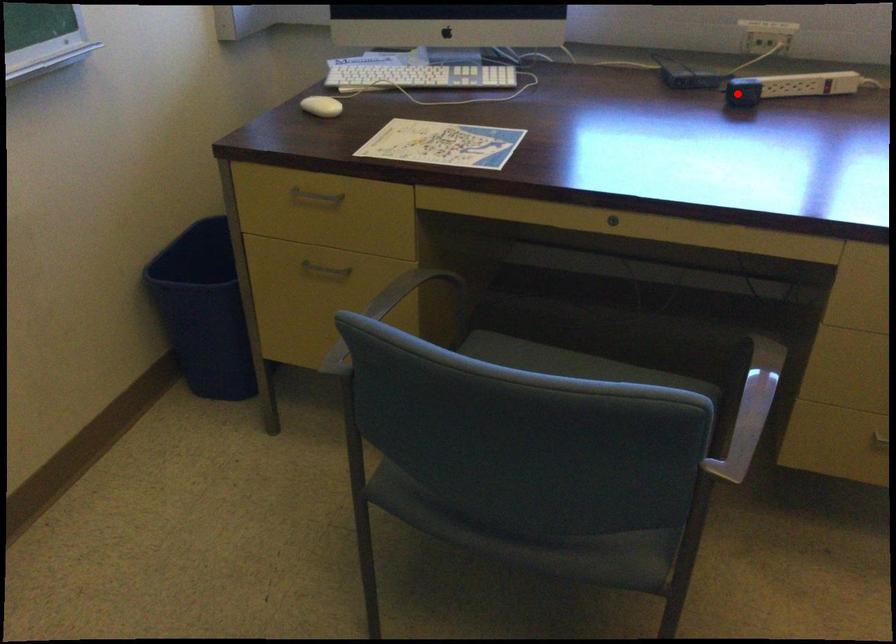
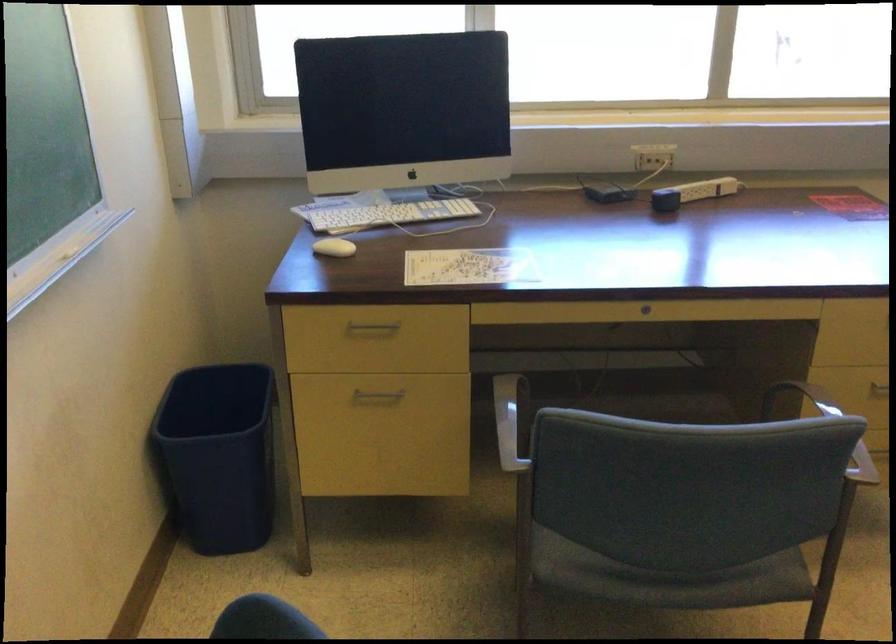
Question: I am providing you with two images of the same scene from different viewpoints. Image1 has a red point marked. In image2, the corresponding 3D location appears at what relative position? Reply with the corresponding letter.

Choices:
 (A) Closer
 (B) Farther

Answer: (B)